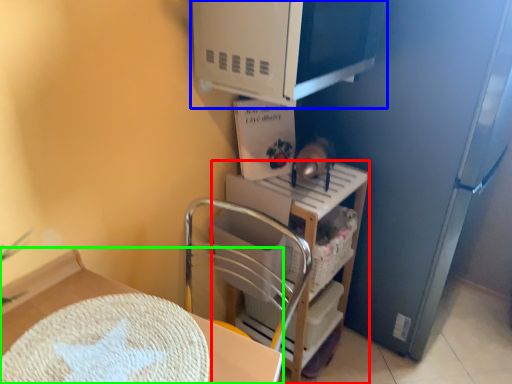
Question: Which object is the farthest from shelf (highlighted by a red box)? Choose among these: appliance (highlighted by a blue box) or furniture (highlighted by a green box).

Choices:
 (A) appliance
 (B) furniture

Answer: (B)